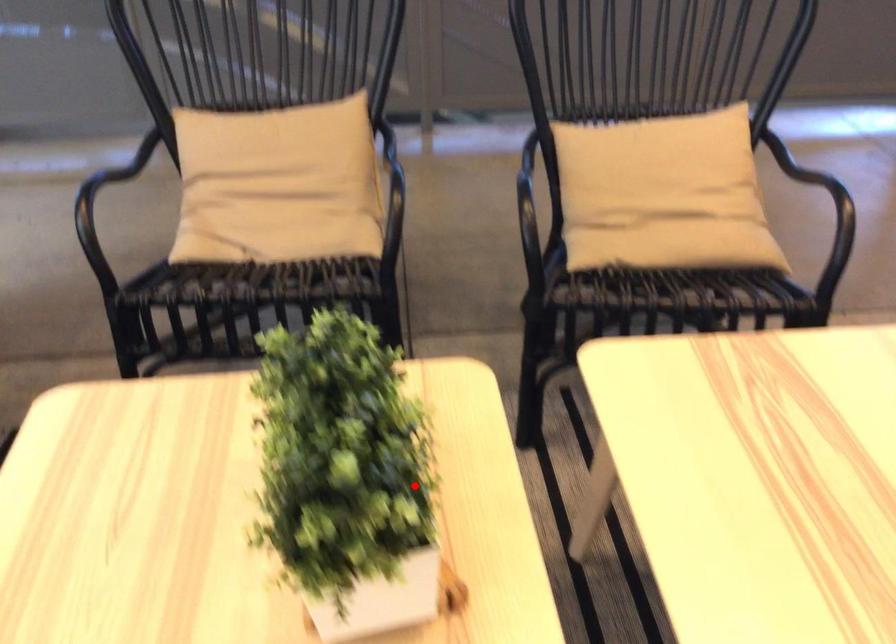
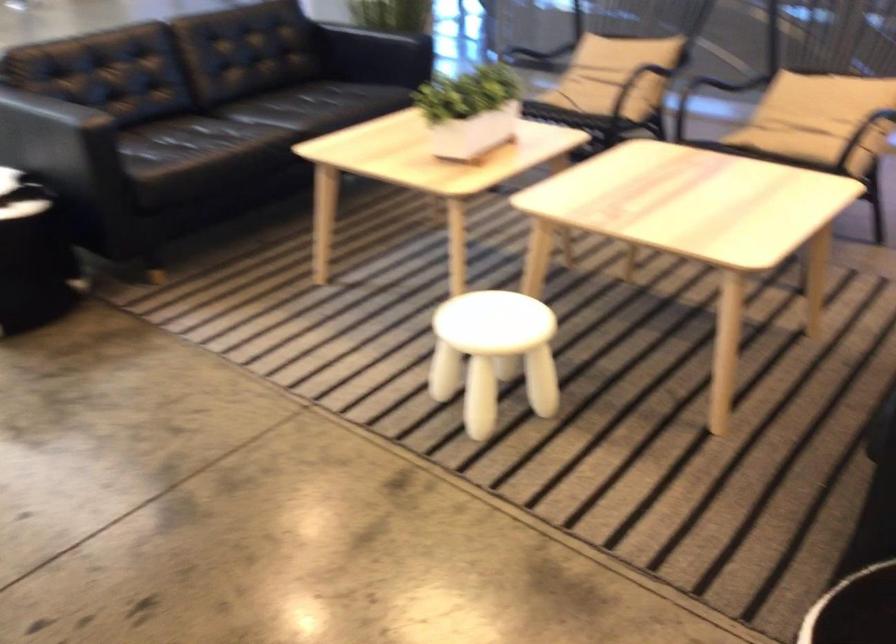
Question: I am providing you with two images of the same scene from different viewpoints. A red point is marked on the first image. Can you still see the location of the red point in image 2?

Choices:
 (A) Yes
 (B) No

Answer: (A)